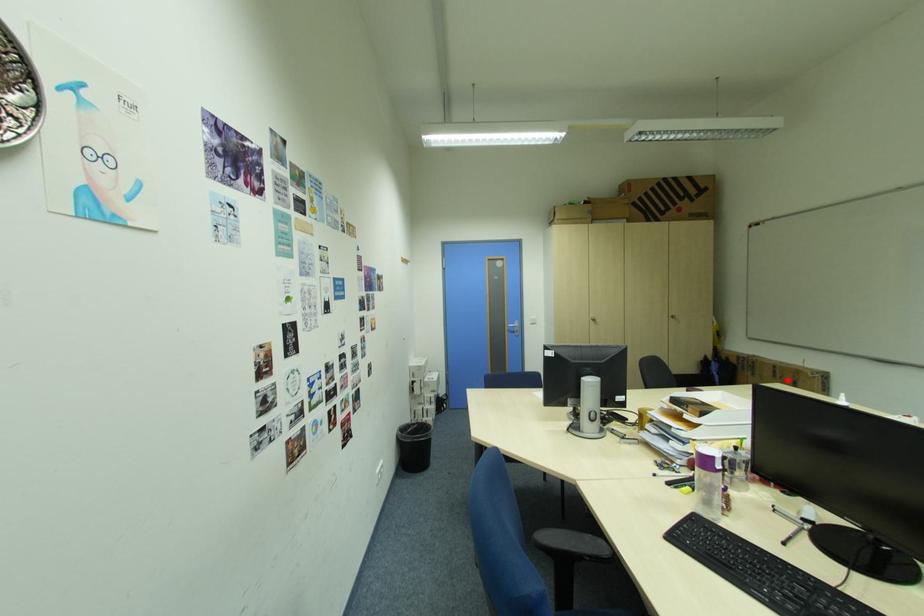
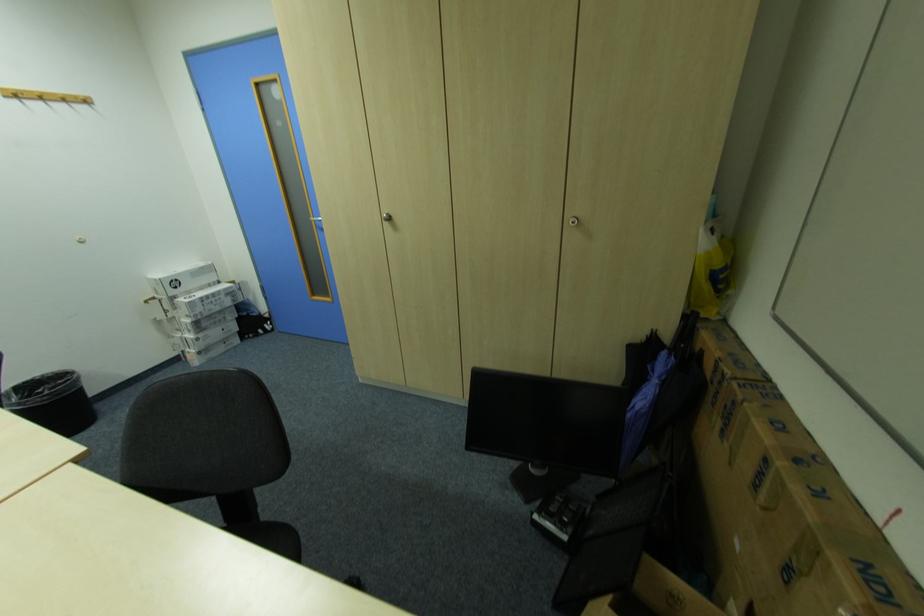
Question: I am providing you with two images of the same scene from different viewpoints. A red point is shown in image1. For the corresponding object point in image2, is it positioned nearer or farther from the camera?

Choices:
 (A) Nearer
 (B) Farther

Answer: (B)